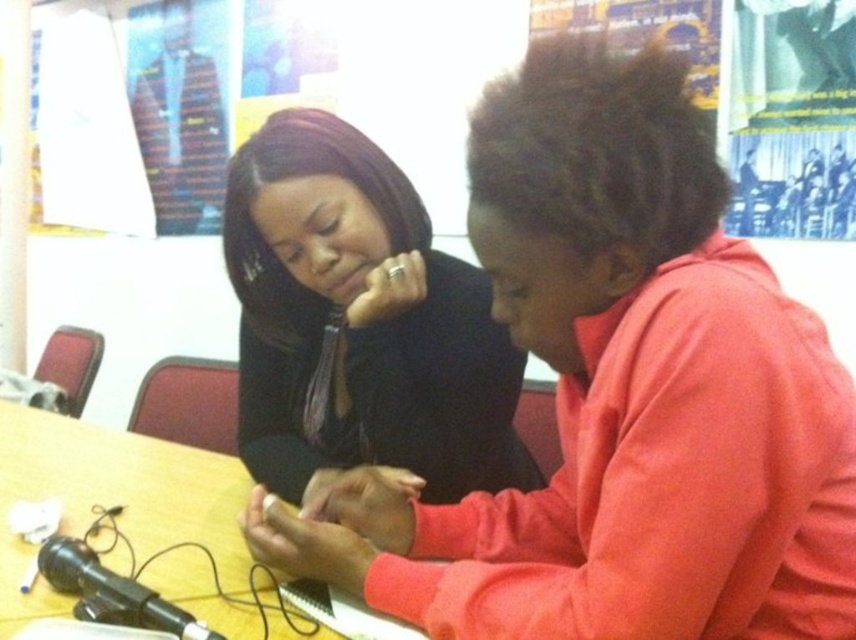
Is matte black shirt at center in front of black satin blouse at center?

That is True.

Between matte black shirt at center and black satin blouse at center, which one appears on the left side from the viewer's perspective?

From the viewer's perspective, black satin blouse at center appears more on the left side.

Identify the location of matte black shirt at center. The height and width of the screenshot is (640, 856). (617, 396).

Identify the location of matte black shirt at center. (617, 396).

Does matte black shirt at center appear over wooden table at center?

Yes, matte black shirt at center is above wooden table at center.

Locate an element on the screen. This screenshot has height=640, width=856. matte black shirt at center is located at coordinates (617, 396).

Is point (788, 324) positioned before point (22, 426)?

That is True.

I want to click on matte black shirt at center, so click(x=617, y=396).

Is black satin blouse at center to the right of wooden table at center from the viewer's perspective?

Indeed, black satin blouse at center is positioned on the right side of wooden table at center.

Is point (325, 134) closer to viewer compared to point (10, 573)?

That is False.

Between point (325, 401) and point (92, 492), which one is positioned in front?

Point (92, 492) is more forward.

This screenshot has height=640, width=856. What are the coordinates of `black satin blouse at center` in the screenshot? It's located at (360, 323).